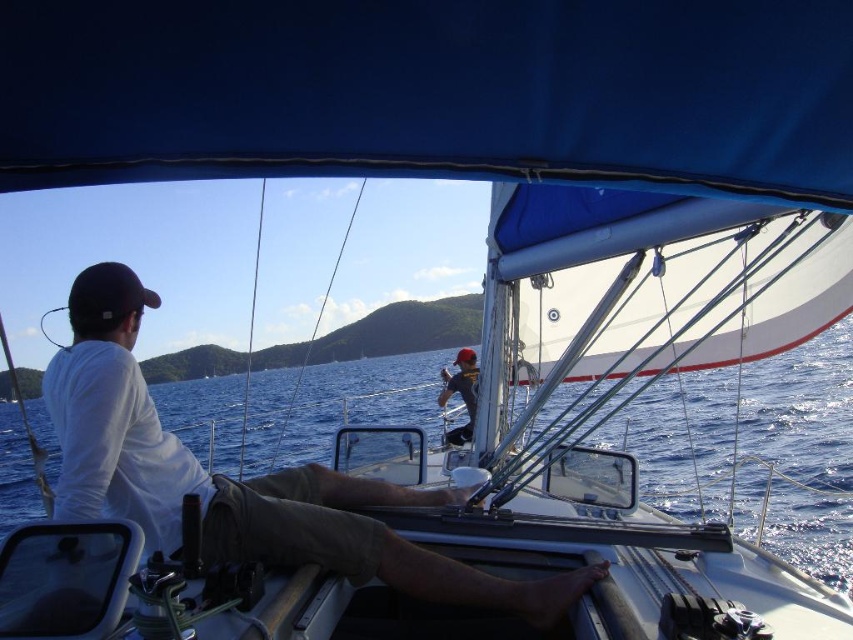
Question: Which point is closer to the camera?

Choices:
 (A) blue water at center
 (B) dark gray fabric cap at upper center

Answer: (A)

Question: Can you confirm if blue water at center is positioned to the left of dark gray fabric cap at upper center?

Choices:
 (A) yes
 (B) no

Answer: (A)

Question: Can you confirm if blue water at center is positioned to the left of dark gray fabric cap at upper center?

Choices:
 (A) yes
 (B) no

Answer: (A)

Question: Among these points, which one is farthest from the camera?

Choices:
 (A) (386, 365)
 (B) (454, 387)

Answer: (A)

Question: Is blue water at center behind dark gray fabric cap at upper center?

Choices:
 (A) yes
 (B) no

Answer: (B)

Question: Which point is farther to the camera?

Choices:
 (A) (838, 413)
 (B) (471, 392)

Answer: (A)